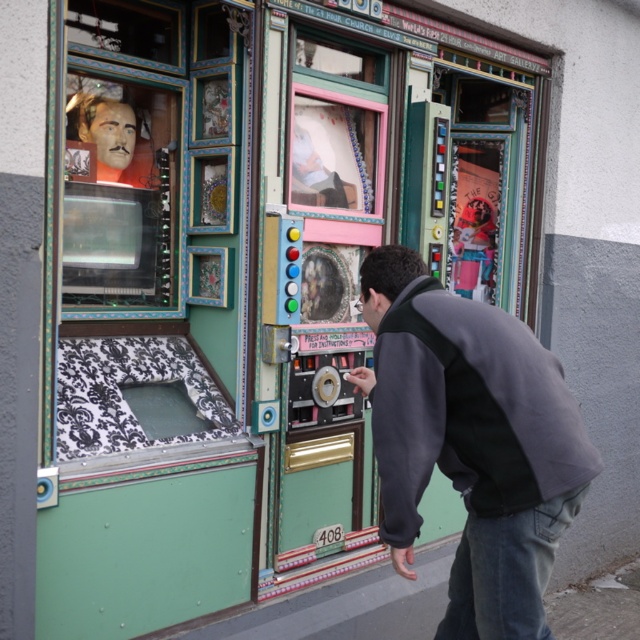
Is dark gray fleece at center below denim at lower right?

Actually, dark gray fleece at center is above denim at lower right.

Is point (536, 435) closer to camera compared to point (566, 522)?

Yes, it is in front of point (566, 522).

Identify the location of dark gray fleece at center. Image resolution: width=640 pixels, height=640 pixels. (472, 442).

What are the coordinates of `dark gray fleece at center` in the screenshot? It's located at (472, 442).